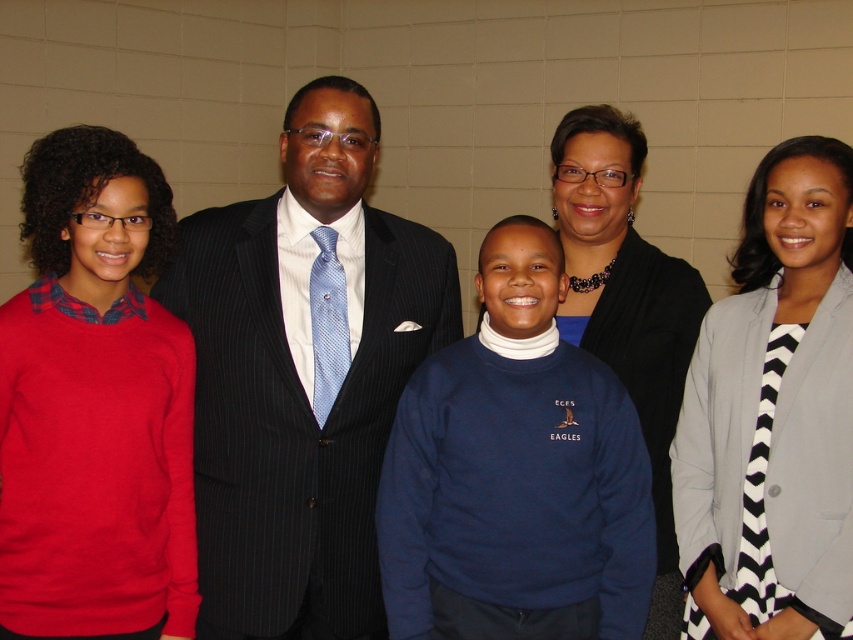
You are standing at the point marked by coordinates point (415, 497) and want to take a photo of the group. The camera you have can focus on subjects within 2 meters. Will the camera be able to capture the group clearly?

The distance between point (415, 497) and the camera is 1.73 meters, which is within the camera focus range of 2 meters. Therefore, the camera can capture the group clearly.

From the picture: You are a photographer who needs to position a spotlight exactly at the center of the navy blue sweater at center. According to the coordinates provided, what are the exact coordinates where you should place the spotlight?

The exact coordinates for placing the spotlight on the navy blue sweater at center are at point (515, 474).